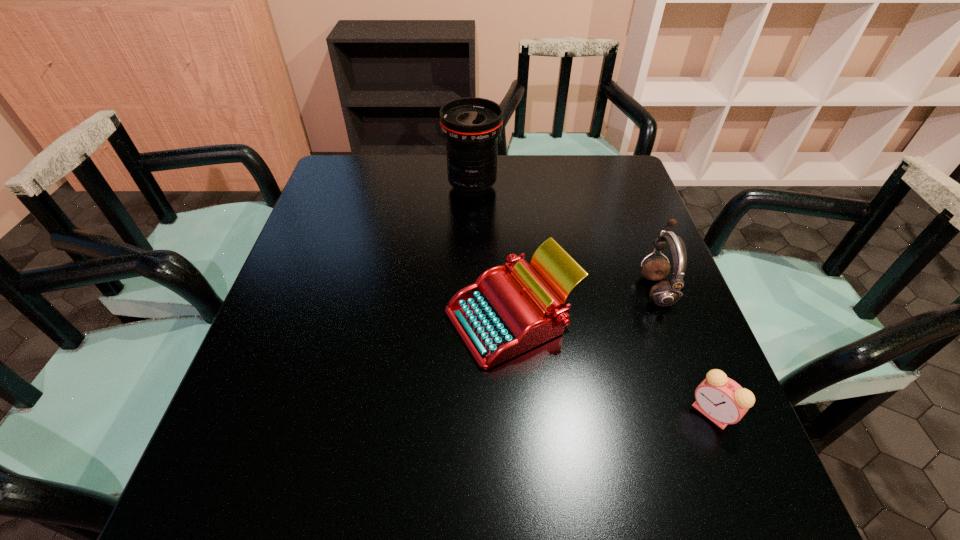
The width and height of the screenshot is (960, 540). What are the coordinates of `vacant space at the left edge of the desktop` in the screenshot? It's located at (311, 360).

This screenshot has height=540, width=960. In the image, there is a desktop. In order to click on free space at the right edge in this screenshot , I will do `click(703, 361)`.

In order to click on free space between the typewriter and the nearest object in this screenshot , I will do `click(612, 366)`.

Locate an element on the screen. This screenshot has height=540, width=960. empty space that is in between the earphone and the typewriter is located at coordinates point(584,304).

Where is `empty space that is in between the typewriter and the alarm clock`? empty space that is in between the typewriter and the alarm clock is located at coordinates (612, 366).

I want to click on vacant space that's between the earphone and the nearest object, so click(684, 351).

The image size is (960, 540). What are the coordinates of `free area in between the typewriter and the second tallest object` in the screenshot? It's located at (584, 304).

Locate an element on the screen. Image resolution: width=960 pixels, height=540 pixels. free area in between the typewriter and the farthest object is located at coordinates (492, 253).

Where is `free space that is in between the telephoto lens and the earphone`? Image resolution: width=960 pixels, height=540 pixels. free space that is in between the telephoto lens and the earphone is located at coordinates (564, 238).

Where is `vacant area that lies between the nearest object and the typewriter`? The width and height of the screenshot is (960, 540). vacant area that lies between the nearest object and the typewriter is located at coordinates (612, 366).